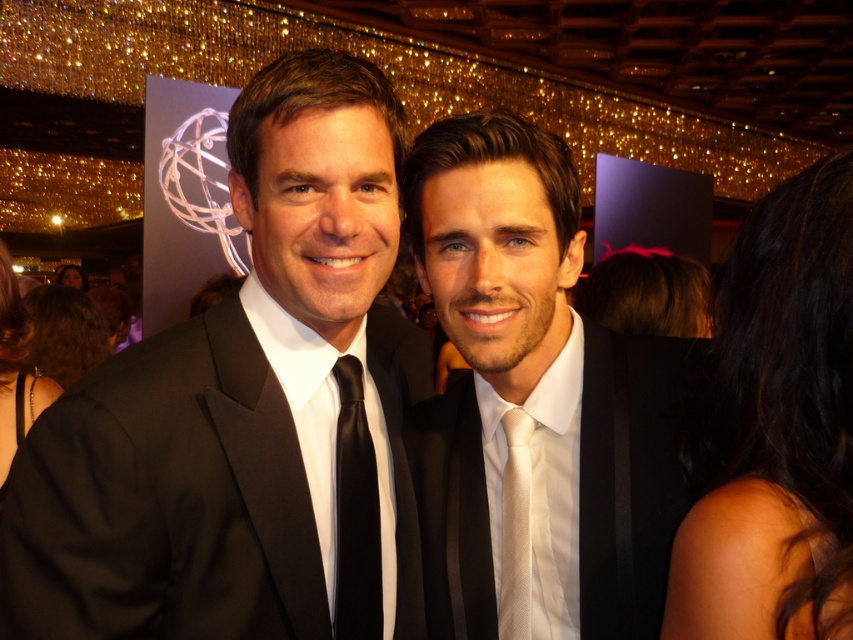
What do you see at coordinates (515, 528) in the screenshot?
I see `silky white tie at center` at bounding box center [515, 528].

At what (x,y) coordinates should I click in order to perform the action: click on silky white tie at center. Please return your answer as a coordinate pair (x, y). The width and height of the screenshot is (853, 640). Looking at the image, I should click on (515, 528).

Between point (508, 534) and point (83, 288), which one is positioned behind?

The point (83, 288) is behind.

Locate an element on the screen. silky white tie at center is located at coordinates (515, 528).

Image resolution: width=853 pixels, height=640 pixels. What do you see at coordinates (355, 513) in the screenshot?
I see `black satin tie at center` at bounding box center [355, 513].

Which is more to the right, black satin tie at center or dark brown hair at upper left?

black satin tie at center is more to the right.

Does point (370, 568) come in front of point (73, 276)?

Yes, it is.

Identify the location of black satin tie at center. The image size is (853, 640). (355, 513).

Does black satin suit at center have a greater height compared to dark brown hair at upper right?

Yes.

Which is behind, point (294, 554) or point (811, 282)?

The point (294, 554) is more distant.

Where is `black satin suit at center`? The image size is (853, 640). black satin suit at center is located at coordinates (242, 413).